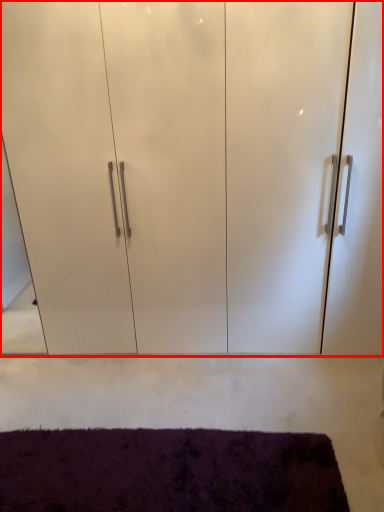
Question: From the image's perspective, what is the correct spatial positioning of cupboard (annotated by the red box) in reference to mat?

Choices:
 (A) below
 (B) above

Answer: (B)